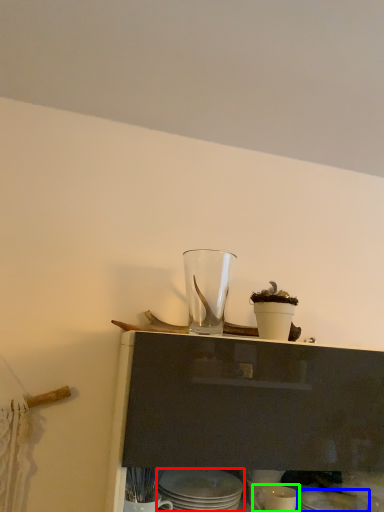
Question: Which object is the closest to the tableware (highlighted by a red box)? Choose among these: tableware (highlighted by a blue box) or tableware (highlighted by a green box).

Choices:
 (A) tableware
 (B) tableware

Answer: (B)